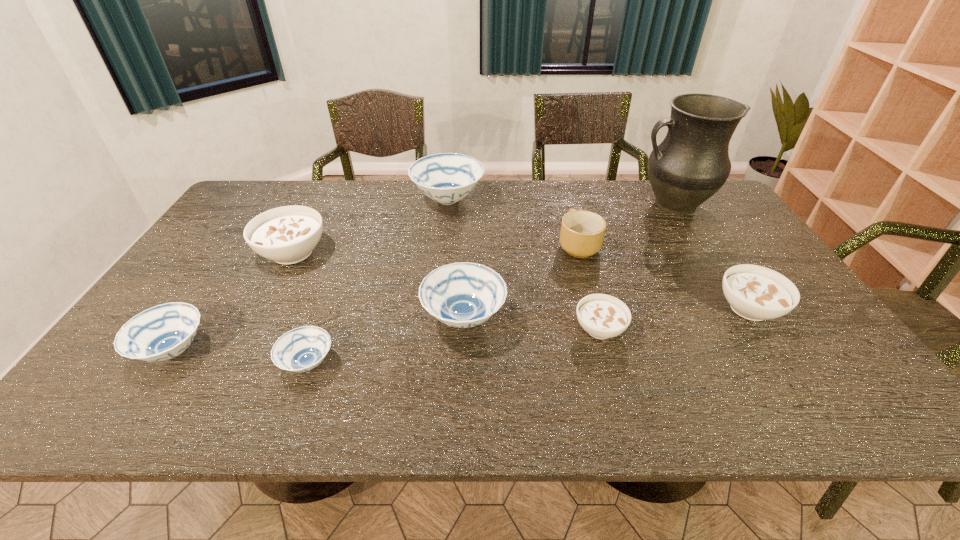
You are a GUI agent. You are given a task and a screenshot of the screen. Output one action in this format:
    pyautogui.click(x=<x>, y=<y>)
    Task: Click on the vacant region located on the side with the handle of the tan mug
    
    Given the screenshot: What is the action you would take?
    pyautogui.click(x=563, y=190)

Image resolution: width=960 pixels, height=540 pixels. What are the coordinates of `vacant area located on the side with the handle of the tan mug` in the screenshot? It's located at (564, 198).

Locate an element on the screen. free space located 0.390m on the left of the second biggest blue soup bowl is located at coordinates click(266, 318).

Where is `vacant space located on the left of the rightmost soup bowl`? The image size is (960, 540). vacant space located on the left of the rightmost soup bowl is located at coordinates (622, 308).

In order to click on free space located 0.170m on the back of the leftmost blue soup bowl in this screenshot , I will do `click(222, 279)`.

Identify the location of vacant space positioned on the right of the smallest white soup bowl. (769, 329).

You are a GUI agent. You are given a task and a screenshot of the screen. Output one action in this format:
    pyautogui.click(x=<x>, y=<y>)
    Task: Click on the vacant space situated on the left of the smallest blue soup bowl
    
    Given the screenshot: What is the action you would take?
    pyautogui.click(x=182, y=363)

Where is `pitcher at the far edge`? pitcher at the far edge is located at coordinates (691, 164).

The image size is (960, 540). I want to click on soup bowl that is at the far edge, so click(x=446, y=178).

Image resolution: width=960 pixels, height=540 pixels. Find the location of `object positioned at the near edge`. object positioned at the near edge is located at coordinates (301, 349).